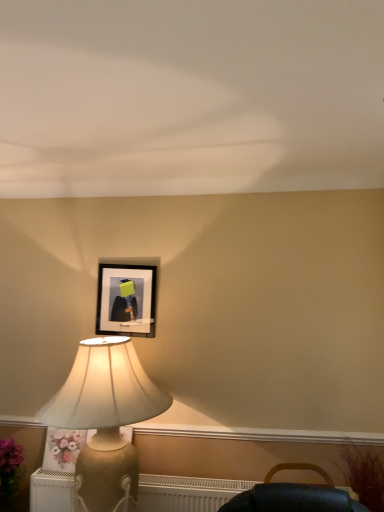
Question: From the image's perspective, is gold textured lamp at left above or below black matte picture frame at upper center?

Choices:
 (A) below
 (B) above

Answer: (A)

Question: From a real-world perspective, is gold textured lamp at left above or below black matte picture frame at upper center?

Choices:
 (A) above
 (B) below

Answer: (B)

Question: Which is nearer to the white textured radiator at lower left?

Choices:
 (A) black matte picture frame at upper center
 (B) gold textured lamp at left
 (C) floral fabric pillow at lower left

Answer: (C)

Question: Which of these objects is positioned closest to the white textured radiator at lower left?

Choices:
 (A) floral fabric pillow at lower left
 (B) gold textured lamp at left
 (C) black matte picture frame at upper center

Answer: (A)